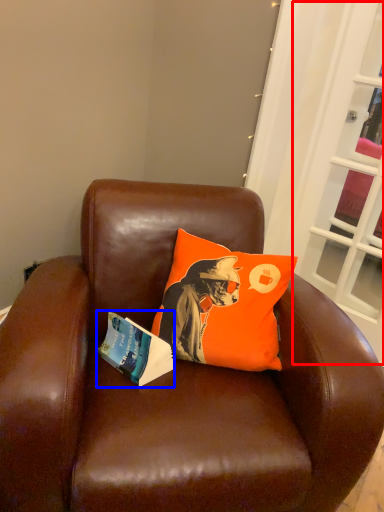
Question: Which of the following is the closest to the observer, screen door (highlighted by a red box) or book (highlighted by a blue box)?

Choices:
 (A) screen door
 (B) book

Answer: (B)